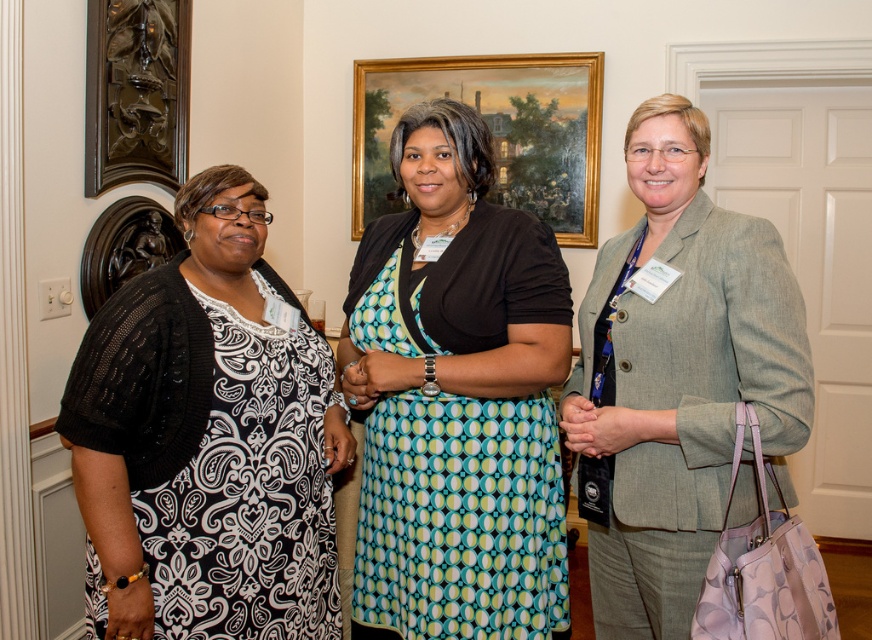
Question: Is black knit cardigan at left to the left of gold-framed painting at center from the viewer's perspective?

Choices:
 (A) no
 (B) yes

Answer: (B)

Question: Does gray wool blazer at center have a lesser width compared to gold-framed painting at center?

Choices:
 (A) no
 (B) yes

Answer: (B)

Question: Which object is positioned farthest from the teal dotted dress at center?

Choices:
 (A) gray wool blazer at center
 (B) black knit cardigan at left
 (C) dark brown carved wood at upper left
 (D) gold-framed painting at center

Answer: (D)

Question: Where is teal dotted dress at center located in relation to gray wool blazer at center in the image?

Choices:
 (A) left
 (B) right

Answer: (A)

Question: Which object is farther from the camera taking this photo?

Choices:
 (A) dark brown carved wood at upper left
 (B) gray wool blazer at center

Answer: (A)

Question: Which of the following is the farthest from the observer?

Choices:
 (A) teal dotted dress at center
 (B) gold-framed painting at center
 (C) gray wool blazer at center
 (D) black knit cardigan at left

Answer: (B)